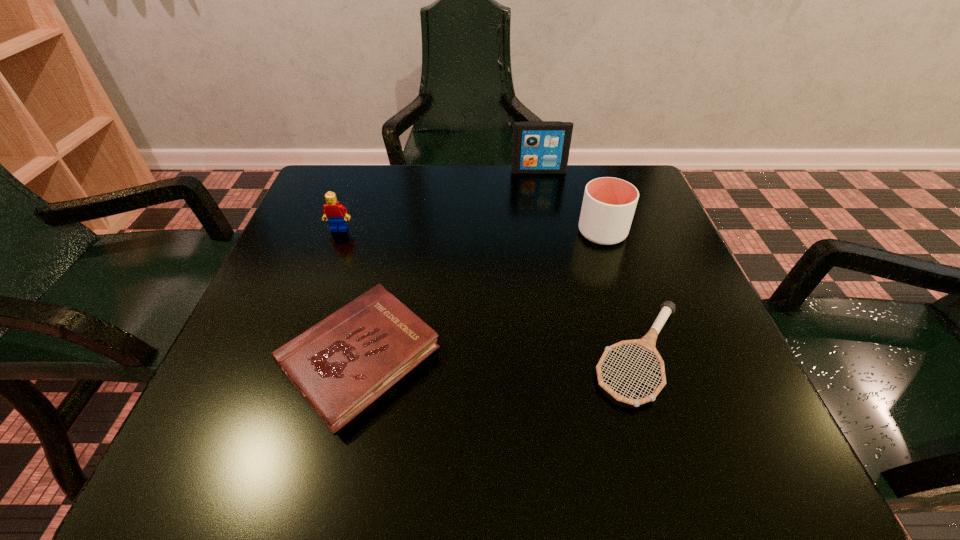
The height and width of the screenshot is (540, 960). What are the coordinates of `empty space that is in between the tennis racket and the cup` in the screenshot? It's located at (621, 293).

Locate an element on the screen. The height and width of the screenshot is (540, 960). free point between the tennis racket and the farthest object is located at coordinates (589, 263).

What are the coordinates of `free space between the tallest object and the cup` in the screenshot? It's located at (570, 202).

Find the location of a particular element. free point between the hardback book and the tennis racket is located at coordinates (500, 357).

Locate an element on the screen. The height and width of the screenshot is (540, 960). free space between the cup and the Lego is located at coordinates [x=470, y=231].

You are a GUI agent. You are given a task and a screenshot of the screen. Output one action in this format:
    pyautogui.click(x=<x>, y=<y>)
    Task: Click on the vacant area that lies between the cup and the tennis racket
    
    Given the screenshot: What is the action you would take?
    pyautogui.click(x=621, y=293)

Choose which object is the fourth nearest neighbor to the iPod. Please provide its 2D coordinates. Your answer should be formatted as a tuple, i.e. [(x, y)], where the tuple contains the x and y coordinates of a point satisfying the conditions above.

[(342, 364)]

Identify which object is located as the fourth nearest to the cup. Please provide its 2D coordinates. Your answer should be formatted as a tuple, i.e. [(x, y)], where the tuple contains the x and y coordinates of a point satisfying the conditions above.

[(334, 212)]

Locate an element on the screen. The width and height of the screenshot is (960, 540). vacant space that satisfies the following two spatial constraints: 1. on the front-facing side of the Lego; 2. on the right side of the cup is located at coordinates (338, 232).

Where is `vacant area in the image that satisfies the following two spatial constraints: 1. on the front screen of the cup; 2. on the right side of the farthest object`? This screenshot has height=540, width=960. vacant area in the image that satisfies the following two spatial constraints: 1. on the front screen of the cup; 2. on the right side of the farthest object is located at coordinates (550, 232).